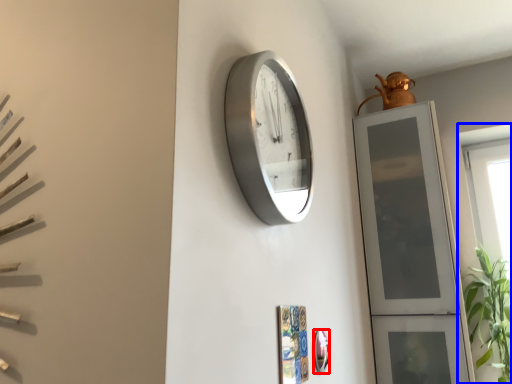
Question: Among these objects, which one is nearest to the camera, mirror (highlighted by a red box) or window (highlighted by a blue box)?

Choices:
 (A) mirror
 (B) window

Answer: (A)